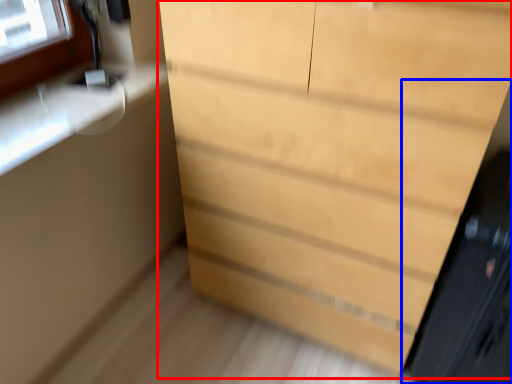
Question: Which of the following is the closest to the observer, chest of drawers (highlighted by a red box) or screen door (highlighted by a blue box)?

Choices:
 (A) chest of drawers
 (B) screen door

Answer: (A)